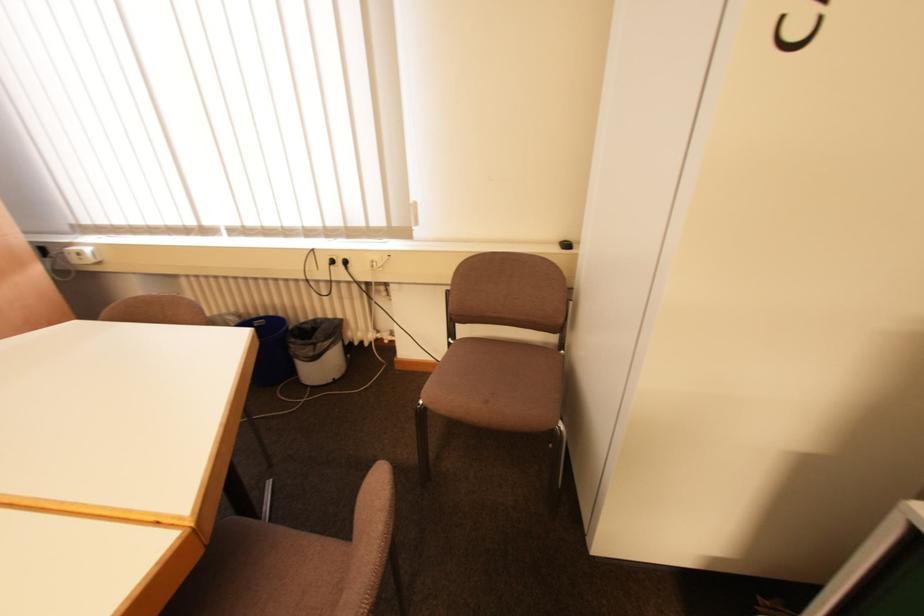
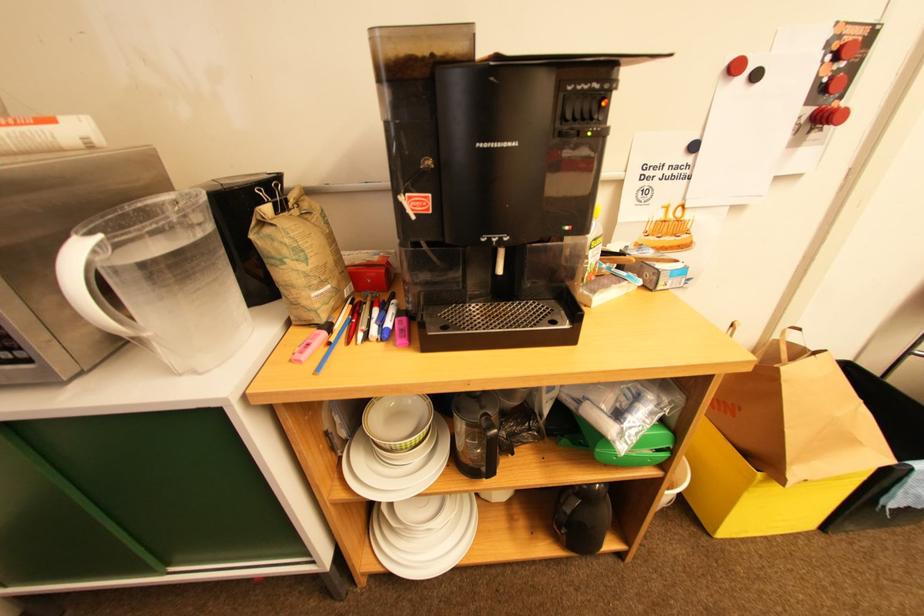
Based on the continuous images, in which direction is the camera rotating?

The rotation direction of the camera is right-down.